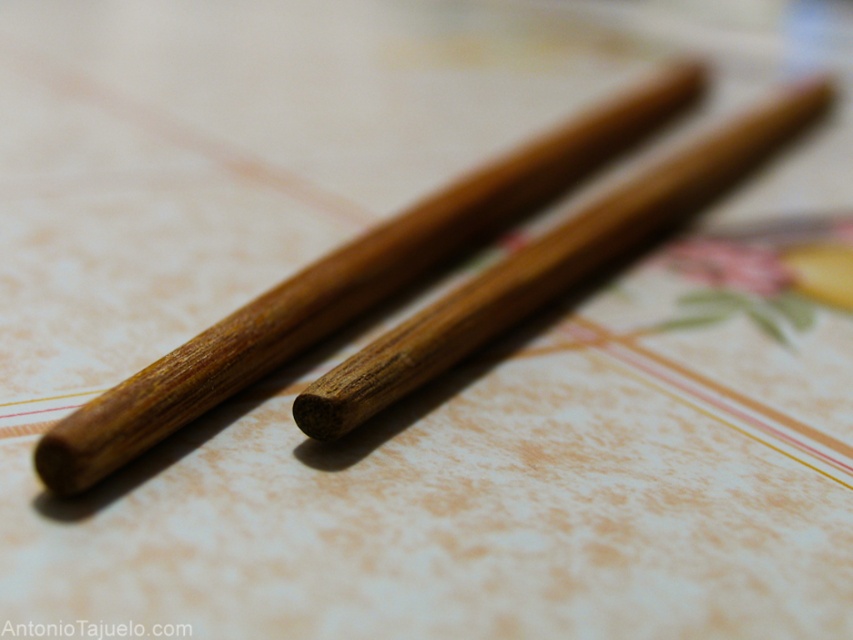
Does wooden chopsticks at center have a smaller size compared to brown wood chopstick at center?

Actually, wooden chopsticks at center might be larger than brown wood chopstick at center.

Which of these two, wooden chopsticks at center or brown wood chopstick at center, stands taller?

wooden chopsticks at center

Is point (642, 106) in front of point (419, 314)?

That is False.

Identify the location of wooden chopsticks at center. The image size is (853, 640). (347, 285).